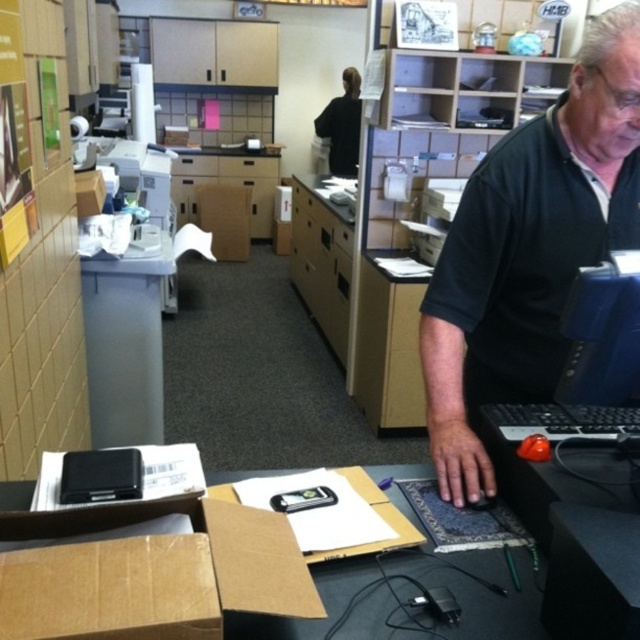
Question: Can you confirm if black plastic laptop at right is positioned to the left of black glossy monitor at upper right?

Choices:
 (A) no
 (B) yes

Answer: (B)

Question: Which object is positioned closest to the black glossy monitor at upper right?

Choices:
 (A) black matte shirt at right
 (B) black plastic laptop at right
 (C) brown cardboard box at center
 (D) brown cardboard box at lower left

Answer: (B)

Question: Which object appears farthest from the camera in this image?

Choices:
 (A) wooden file cabinet at center
 (B) black glossy monitor at upper right
 (C) black plastic laptop at right
 (D) brown cardboard box at lower left

Answer: (A)

Question: Which object is the closest to the black matte shirt at right?

Choices:
 (A) wooden file cabinet at center
 (B) black plastic laptop at right

Answer: (B)

Question: Can you confirm if black matte shirt at right is smaller than black glossy monitor at upper right?

Choices:
 (A) no
 (B) yes

Answer: (A)

Question: From the image, what is the correct spatial relationship of black plastic laptop at right in relation to brown cardboard box at center?

Choices:
 (A) below
 (B) above

Answer: (A)